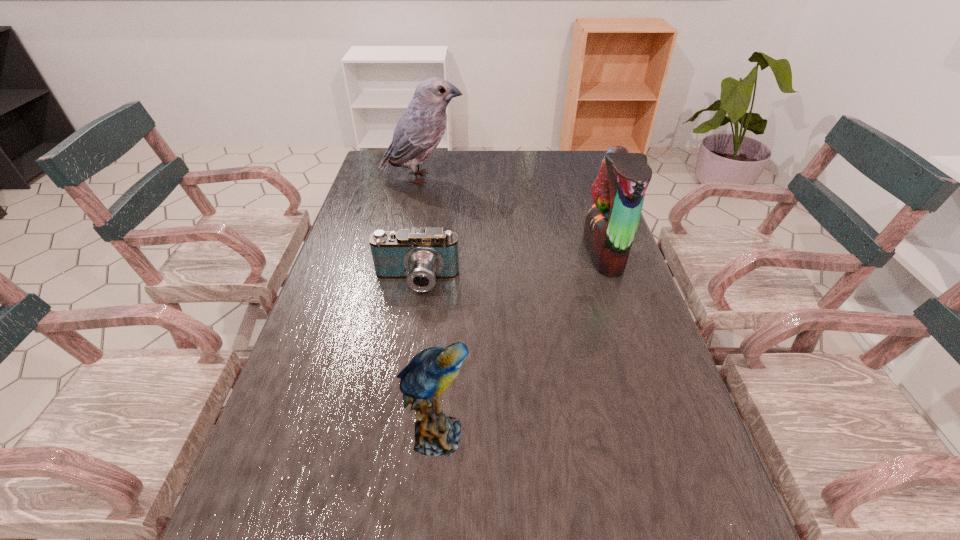
This screenshot has width=960, height=540. I want to click on vacant area between the nearest parrot and the rightmost object, so click(520, 343).

At what (x,y) coordinates should I click in order to perform the action: click on vacant region between the rightmost object and the nearest parrot. Please return your answer as a coordinate pair (x, y). Looking at the image, I should click on (520, 343).

This screenshot has width=960, height=540. What are the coordinates of `free space that is in between the rightmost object and the farthest object` in the screenshot? It's located at (514, 215).

You are a GUI agent. You are given a task and a screenshot of the screen. Output one action in this format:
    pyautogui.click(x=<x>, y=<y>)
    Task: Click on the free space between the farthest object and the nearest object
    
    Given the screenshot: What is the action you would take?
    pyautogui.click(x=429, y=306)

This screenshot has width=960, height=540. In order to click on the second closest object to the farthest parrot in this screenshot , I will do `click(618, 192)`.

Find the location of a particular element. The width and height of the screenshot is (960, 540). object that stands as the closest to the nearest object is located at coordinates (421, 256).

You are a GUI agent. You are given a task and a screenshot of the screen. Output one action in this format:
    pyautogui.click(x=<x>, y=<y>)
    Task: Click on the parrot that is the second closest to the farthest parrot
    
    Given the screenshot: What is the action you would take?
    pyautogui.click(x=430, y=372)

Find the location of a particular element. The height and width of the screenshot is (540, 960). parrot that is the second nearest to the farthest parrot is located at coordinates (430, 372).